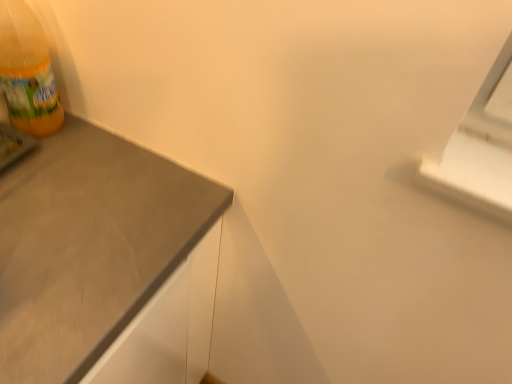
At what (x,y) coordinates should I click in order to perform the action: click on translucent yellow bottle at left. Please return your answer as a coordinate pair (x, y). Image resolution: width=512 pixels, height=384 pixels. Looking at the image, I should click on (27, 72).

The image size is (512, 384). What do you see at coordinates (27, 72) in the screenshot? I see `translucent yellow bottle at left` at bounding box center [27, 72].

The width and height of the screenshot is (512, 384). In order to click on translucent yellow bottle at left in this screenshot , I will do `click(27, 72)`.